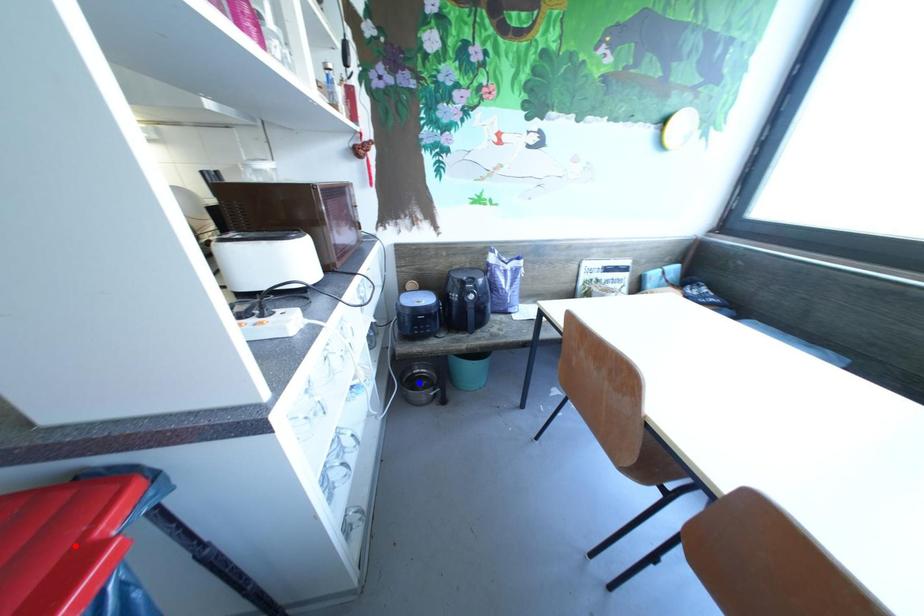
Question: Two points are marked on the image. Which point is closer to the camera?

Choices:
 (A) Blue point is closer.
 (B) Red point is closer.

Answer: (B)